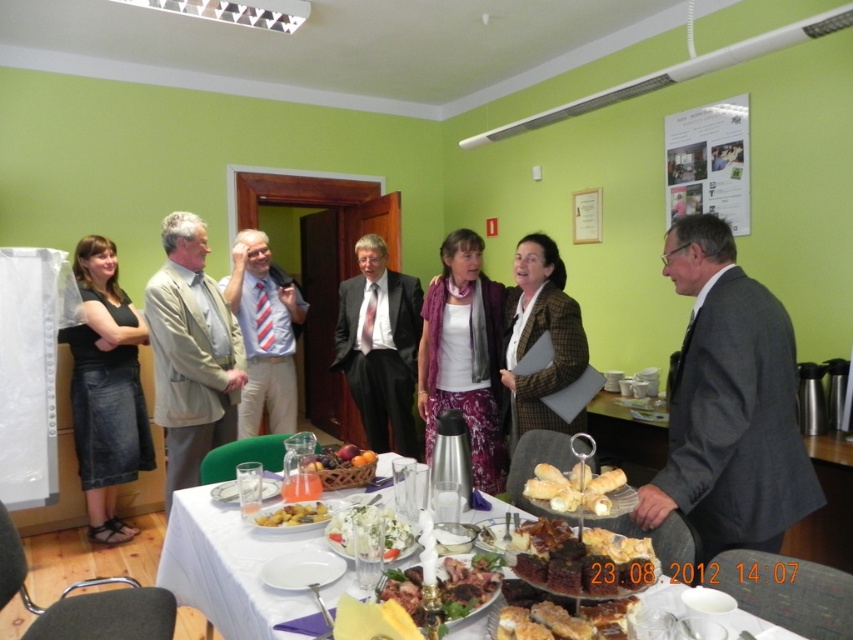
Question: Can you confirm if gray suit at right is positioned above black denim skirt at left?

Choices:
 (A) no
 (B) yes

Answer: (B)

Question: Based on their relative distances, which object is farther from the purple fabric scarf at center?

Choices:
 (A) gray suit at right
 (B) black denim skirt at left
 (C) plaid wool jacket at center

Answer: (B)

Question: Is golden crispy pastry at center thinner than golden fried potatoes at center?

Choices:
 (A) no
 (B) yes

Answer: (B)

Question: Which of the following is the closest to the observer?

Choices:
 (A) golden fried potatoes at center
 (B) fresh fruit basket at center
 (C) matte blue shirt at center

Answer: (A)

Question: Which object is closer to the camera taking this photo?

Choices:
 (A) chocolate cake at center
 (B) matte blue shirt at center
 (C) purple fabric scarf at center
 (D) plaid wool jacket at center

Answer: (A)

Question: Can you confirm if matte blue shirt at center is positioned to the left of fresh fruit basket at center?

Choices:
 (A) yes
 (B) no

Answer: (A)